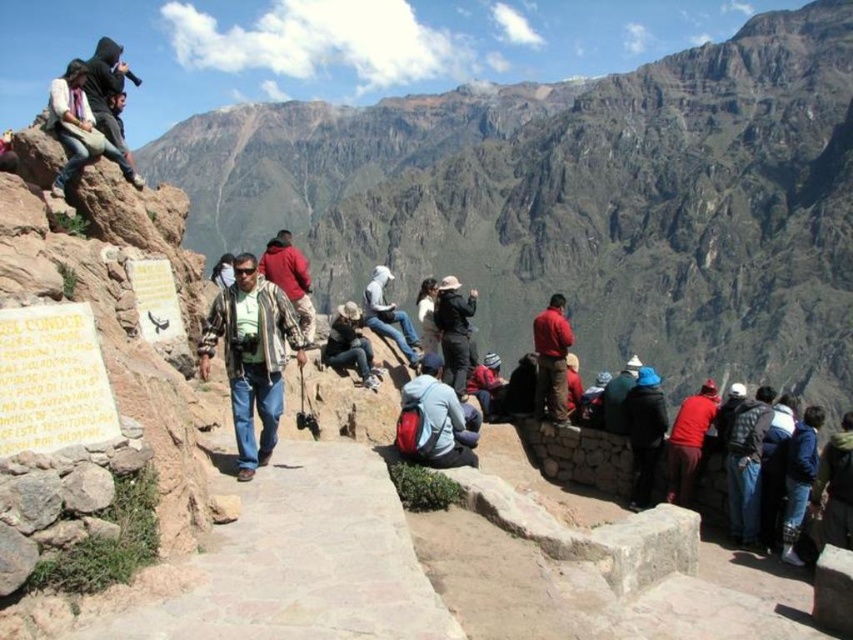
Question: Is dark gray jacket at center wider than denim jacket at center?

Choices:
 (A) yes
 (B) no

Answer: (B)

Question: Is dark blue jacket at center to the left of red cotton shirt at right from the viewer's perspective?

Choices:
 (A) no
 (B) yes

Answer: (A)

Question: Estimate the real-world distances between objects in this image. Which object is farther from the white fleece jacket at center?

Choices:
 (A) camouflage jacket at center
 (B) red cotton shirt at right
 (C) white cotton jacket at center

Answer: (B)

Question: Is red cotton shirt at right smaller than white fleece jacket at center?

Choices:
 (A) no
 (B) yes

Answer: (B)

Question: Which object appears farthest from the camera in this image?

Choices:
 (A) red backpack at center
 (B) dark blue jeans at lower right
 (C) dark brown leather jacket at lower right
 (D) red cotton shirt at right

Answer: (D)

Question: Among these objects, which one is farthest from the camera?

Choices:
 (A) dark gray jacket at center
 (B) red knitted hat at center

Answer: (B)